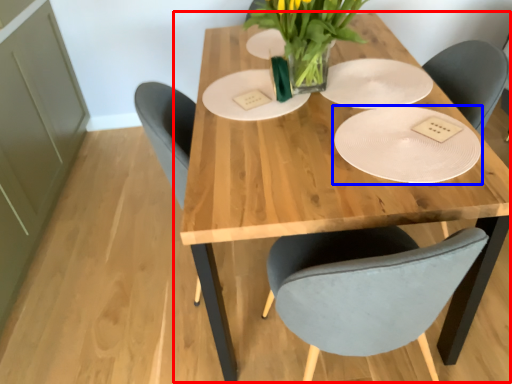
Question: Which of the following is the closest to the observer, table (highlighted by a red box) or plate (highlighted by a blue box)?

Choices:
 (A) table
 (B) plate

Answer: (A)